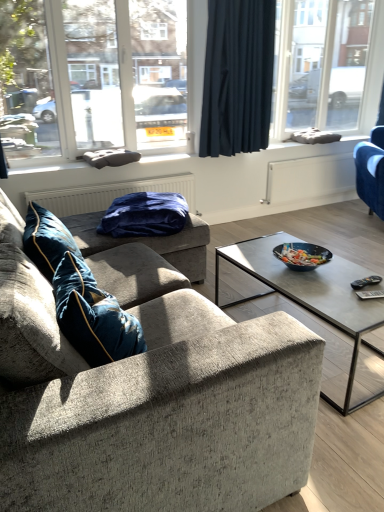
Question: From a real-world perspective, is dark blue fabric curtain at upper center positioned above or below textured gray couch at center, placed as the second studio couch when sorted from right to left?

Choices:
 (A) above
 (B) below

Answer: (A)

Question: Would you say dark blue fabric curtain at upper center is to the left or to the right of textured gray couch at center, which is the first studio couch in left-to-right order, in the picture?

Choices:
 (A) right
 (B) left

Answer: (A)

Question: Which of these objects is positioned closest to the textured gray couch at center, arranged as the 2th studio couch when viewed from the back?

Choices:
 (A) velvet blue pillow at left, acting as the second pillow starting from the back
 (B) blue plush blanket at center, which is the second pillow from front to back
 (C) transparent glass window at upper left, the second window positioned from the right
 (D) transparent glass window at upper right, the second window when ordered from front to back
 (E) velvet blue armchair at right, acting as the first studio couch starting from the right

Answer: (A)

Question: Considering the real-world distances, which object is farthest from the textured gray couch at center, the 1th studio couch from the front?

Choices:
 (A) velvet blue armchair at right, which ranks as the second studio couch in front-to-back order
 (B) dark blue fabric curtain at upper center
 (C) velvet blue pillow at left, the first pillow positioned from the front
 (D) transparent glass window at upper left, which is the 2th window in back-to-front order
 (E) blue plush blanket at center, which is the second pillow from front to back

Answer: (A)